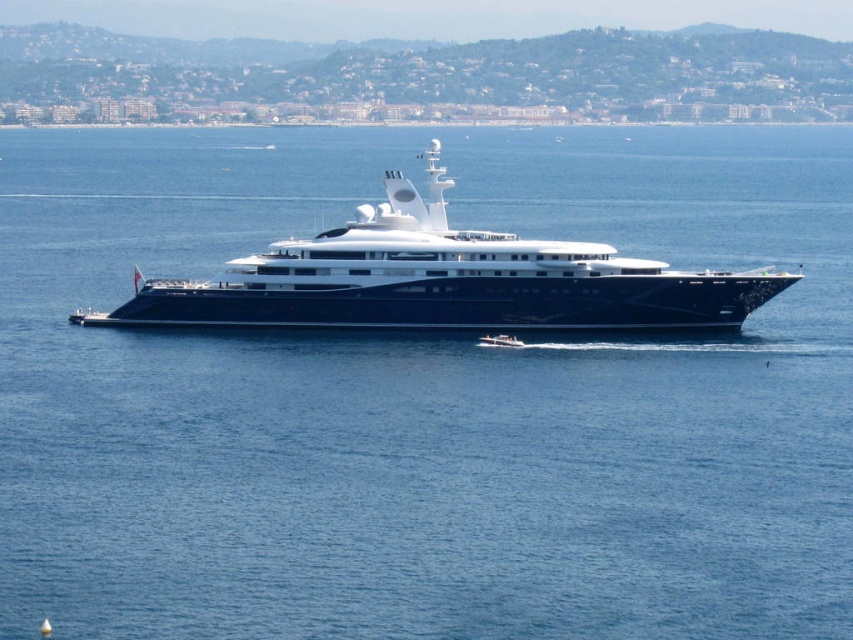
Question: Which point is closer to the camera?

Choices:
 (A) (415, 204)
 (B) (498, 346)

Answer: (B)

Question: Can you confirm if white glossy cruise ship at center is smaller than white glossy speedboat at center?

Choices:
 (A) no
 (B) yes

Answer: (A)

Question: Which of the following is the farthest from the observer?

Choices:
 (A) (225, 276)
 (B) (498, 344)

Answer: (A)

Question: Is white glossy cruise ship at center thinner than white glossy speedboat at center?

Choices:
 (A) yes
 (B) no

Answer: (B)

Question: Does white glossy cruise ship at center appear on the left side of white glossy speedboat at center?

Choices:
 (A) yes
 (B) no

Answer: (A)